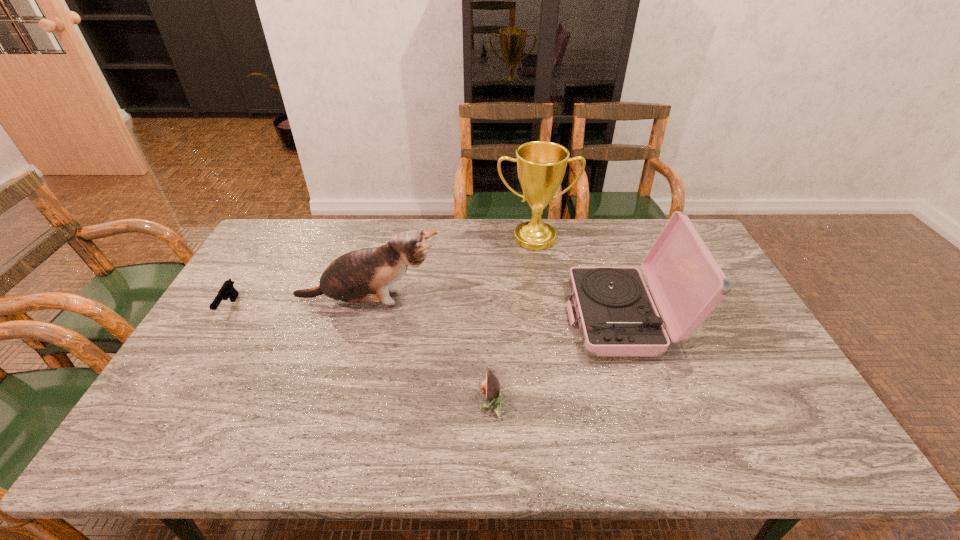
Where is `vacant area that lies between the pistol and the record player`? The height and width of the screenshot is (540, 960). vacant area that lies between the pistol and the record player is located at coordinates (426, 313).

Identify which object is located as the second nearest to the record player. Please provide its 2D coordinates. Your answer should be formatted as a tuple, i.e. [(x, y)], where the tuple contains the x and y coordinates of a point satisfying the conditions above.

[(490, 386)]

The image size is (960, 540). In order to click on object that is the closest one to the farthest object in this screenshot , I will do `click(617, 317)`.

The image size is (960, 540). I want to click on vacant position in the image that satisfies the following two spatial constraints: 1. at the face of the second object from left to right; 2. on the front-facing side of the pistol, so click(x=367, y=307).

Where is `free region that satisfies the following two spatial constraints: 1. by the handles of the farthest object; 2. on the seed side of the third object from right to left`? The image size is (960, 540). free region that satisfies the following two spatial constraints: 1. by the handles of the farthest object; 2. on the seed side of the third object from right to left is located at coordinates (560, 402).

Identify the location of free region that satisfies the following two spatial constraints: 1. by the handles of the award; 2. at the face of the fourth object from right to left. The height and width of the screenshot is (540, 960). (544, 300).

Where is `free space in the image that satisfies the following two spatial constraints: 1. by the handles of the award; 2. at the face of the second object from left to right`? The height and width of the screenshot is (540, 960). free space in the image that satisfies the following two spatial constraints: 1. by the handles of the award; 2. at the face of the second object from left to right is located at coordinates (544, 300).